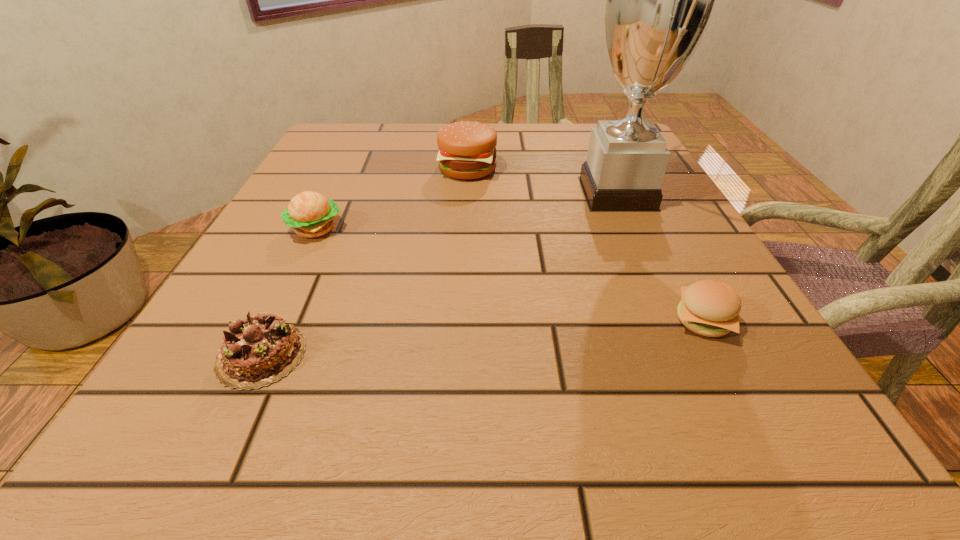
Image resolution: width=960 pixels, height=540 pixels. Find the location of `the tallest object`. the tallest object is located at coordinates (660, 0).

Where is `the farthest hamburger`? The image size is (960, 540). the farthest hamburger is located at coordinates click(467, 150).

This screenshot has width=960, height=540. I want to click on the second hamburger from left to right, so click(467, 150).

The height and width of the screenshot is (540, 960). What are the coordinates of `the second farthest hamburger` in the screenshot? It's located at (311, 214).

Where is `the rightmost hamburger`? The image size is (960, 540). the rightmost hamburger is located at coordinates (710, 308).

Locate an element on the screen. This screenshot has height=540, width=960. the shortest object is located at coordinates (257, 351).

Locate an element on the screen. Image resolution: width=960 pixels, height=540 pixels. free location located 0.190m at the front view of the trophy cup is located at coordinates (482, 193).

The width and height of the screenshot is (960, 540). In order to click on vacant space located 0.220m at the front view of the trophy cup in this screenshot , I will do `click(468, 193)`.

This screenshot has height=540, width=960. I want to click on free point located 0.230m at the front view of the trophy cup, so click(463, 193).

This screenshot has width=960, height=540. I want to click on free space located on the front of the third object from right to left, so click(463, 274).